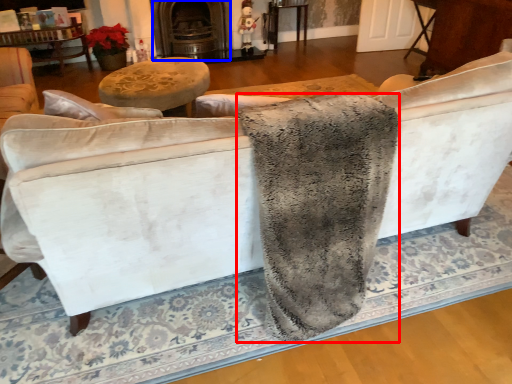
Question: Which object is closer to the camera taking this photo, blanket (highlighted by a red box) or fireplace (highlighted by a blue box)?

Choices:
 (A) blanket
 (B) fireplace

Answer: (A)